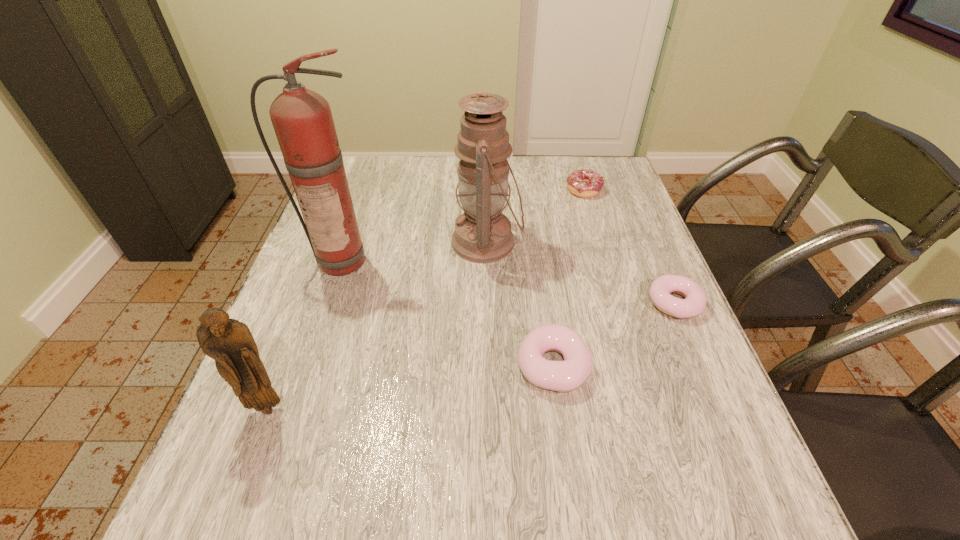
Locate an element on the screen. The width and height of the screenshot is (960, 540). free region at the far edge of the desktop is located at coordinates (535, 157).

Locate an element on the screen. The image size is (960, 540). free location at the near edge of the desktop is located at coordinates (497, 422).

At what (x,y) coordinates should I click in order to perform the action: click on blank space at the left edge of the desktop. Please return your answer as a coordinate pair (x, y). Image resolution: width=960 pixels, height=540 pixels. Looking at the image, I should click on (232, 409).

The width and height of the screenshot is (960, 540). In the image, there is a desktop. Identify the location of free space at the right edge. (627, 248).

In order to click on vacant space at the far left corner of the desktop in this screenshot , I will do `click(363, 177)`.

Where is `free point at the far right corner`? The image size is (960, 540). free point at the far right corner is located at coordinates (602, 191).

Image resolution: width=960 pixels, height=540 pixels. Find the location of `vacant area at the near right corner`. vacant area at the near right corner is located at coordinates (645, 438).

The height and width of the screenshot is (540, 960). In order to click on vacant point located between the leftmost doughnut and the farthest object in this screenshot , I will do `click(568, 278)`.

Locate an element on the screen. unoccupied position between the nearest doughnut and the rightmost doughnut is located at coordinates (614, 334).

Where is `free spot between the fire extinguisher and the nearest doughnut`? The image size is (960, 540). free spot between the fire extinguisher and the nearest doughnut is located at coordinates (448, 312).